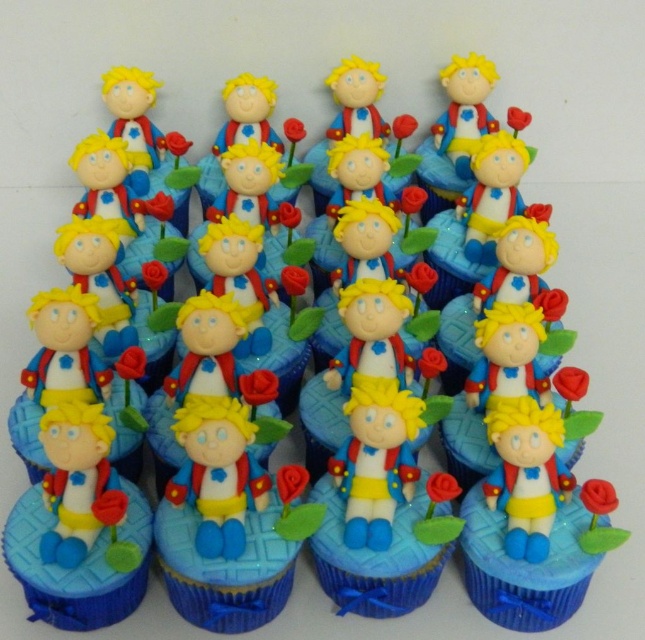
Describe the element at coordinates (524, 566) in the screenshot. The image size is (645, 640). I see `matte blue cupcake at center` at that location.

Based on the photo, does matte blue cupcake at center lie behind matte plastic figurine at center?

Yes, matte blue cupcake at center is further from the viewer.

Who is more distant from viewer, (590, 572) or (390, 605)?

The point (390, 605) is behind.

I want to click on matte blue cupcake at center, so click(524, 566).